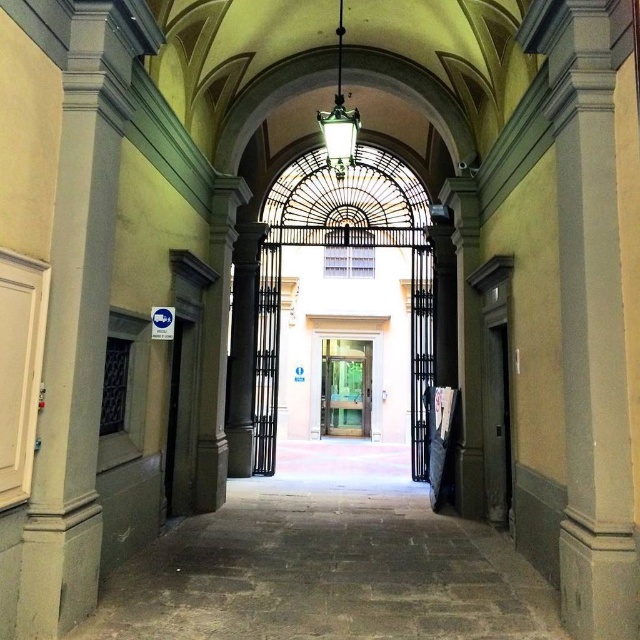
You are a delivery person needing to enter through either the dark gray wooden door at right or the clear glass door at center. Which door should you choose if you have a tall delivery package that requires more vertical clearance?

The clear glass door at center is taller than the dark gray wooden door at right, so you should choose the clear glass door at center to accommodate your tall delivery package.

You are a delivery person carrying a large package and need to choose between the dark gray wooden door at right and the clear glass door at center. Which door should you choose to ensure your package fits through?

The clear glass door at center is wider since it is thicker than the dark gray wooden door at right. Choose the clear glass door at center to fit through with your large package.